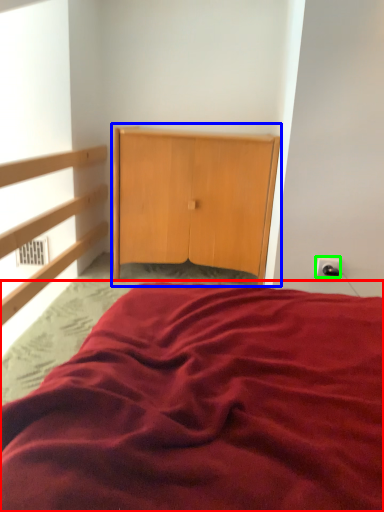
Question: Estimate the real-world distances between objects in this image. Which object is farther from bed (highlighted by a red box), dresser (highlighted by a blue box) or electric outlet (highlighted by a green box)?

Choices:
 (A) dresser
 (B) electric outlet

Answer: (A)